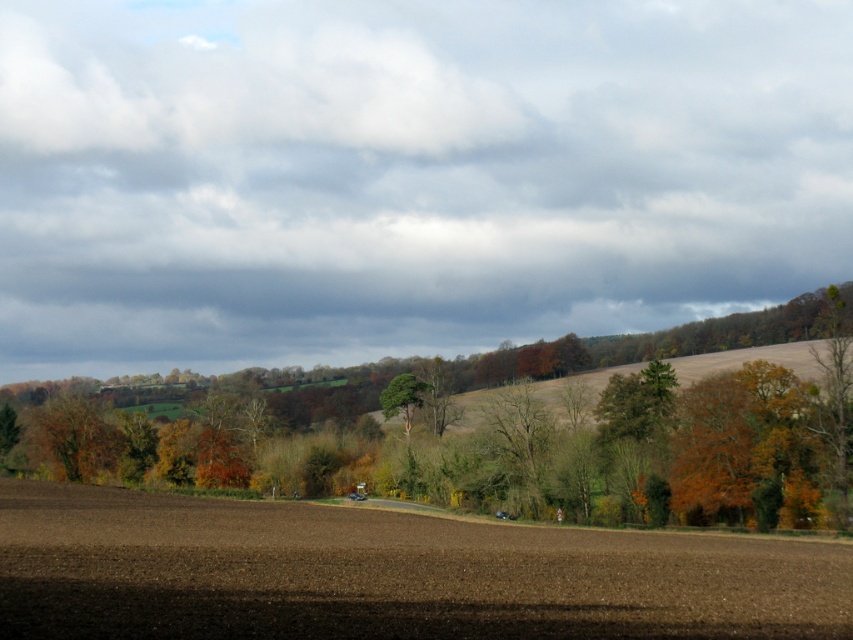
Which is more to the left, brown soil at center or brown leafy tree at center?

brown soil at center

Can you confirm if brown soil at center is wider than brown leafy tree at center?

In fact, brown soil at center might be narrower than brown leafy tree at center.

Find the location of a particular element. The height and width of the screenshot is (640, 853). brown soil at center is located at coordinates (386, 573).

Does point (332, 584) come in front of point (392, 404)?

Yes, it is in front of point (392, 404).

This screenshot has width=853, height=640. Describe the element at coordinates (386, 573) in the screenshot. I see `brown soil at center` at that location.

Locate an element on the screen. brown soil at center is located at coordinates (386, 573).

Which is more to the right, brown leafy tree at center or green rough bark tree at center?

brown leafy tree at center

Is brown leafy tree at center shorter than green rough bark tree at center?

In fact, brown leafy tree at center may be taller than green rough bark tree at center.

Locate an element on the screen. This screenshot has width=853, height=640. brown leafy tree at center is located at coordinates (511, 438).

You are a GUI agent. You are given a task and a screenshot of the screen. Output one action in this format:
    pyautogui.click(x=<x>, y=<y>)
    Task: Click on the brown leafy tree at center
    
    Given the screenshot: What is the action you would take?
    pyautogui.click(x=511, y=438)